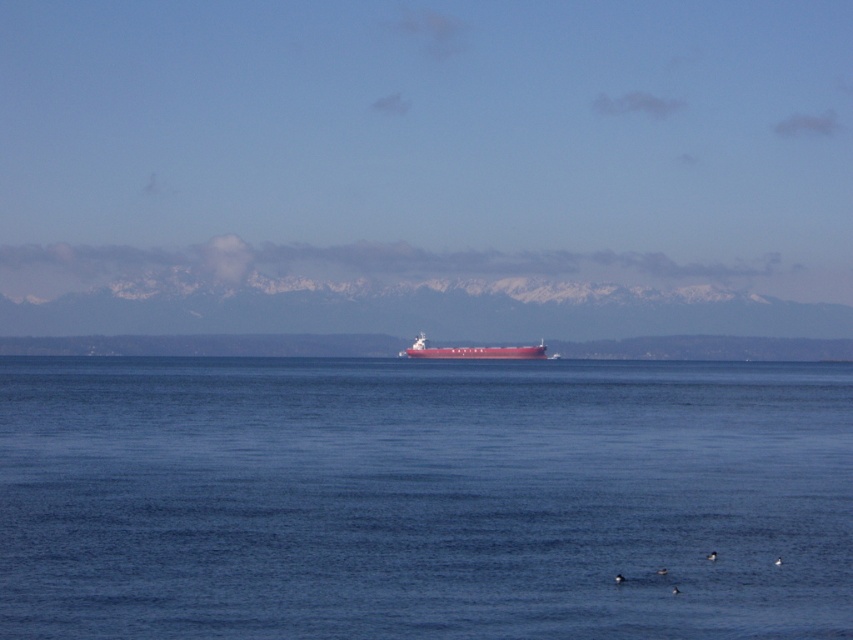
You are standing on a cliff overlooking the sea and want to estimate how far the blue smooth water at center is from you. Based on the scene, can you determine the distance?

The blue smooth water at center is 80.78 feet away from the camera, so the distance from the cliff to the blue smooth water at center is approximately 80.78 feet.

You are a photographer planning to capture the entire scene of the blue smooth water at center and the matte red ship at center in a single shot. Based on their widths, which object should you position closer to the edge of the frame to ensure both fit within the camera view?

The blue smooth water at center is wider than the matte red ship at center, so positioning the blue smooth water at center closer to the edge of the frame would allow both objects to fit within the camera view.

You are a photographer planning to capture the blue smooth water at center and the matte red ship at center in a single shot. Based on the scene, which object will occupy a larger portion of the photo?

The blue smooth water at center is bigger than the matte red ship at center, so it will occupy a larger portion of the photo.